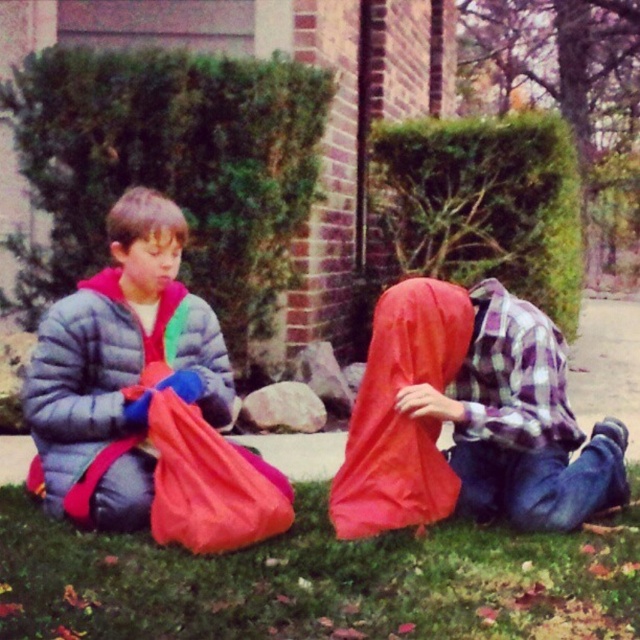
Question: Can you confirm if green grass at lower center is positioned to the right of matte blue puffer jacket at left?

Choices:
 (A) no
 (B) yes

Answer: (B)

Question: Does plaid fabric bag at center have a smaller size compared to matte red sleeping bag at center?

Choices:
 (A) no
 (B) yes

Answer: (A)

Question: Among these objects, which one is nearest to the camera?

Choices:
 (A) matte red plastic bag at lower left
 (B) plaid fabric bag at center
 (C) matte blue puffer jacket at left

Answer: (A)

Question: Which of these objects is positioned closest to the green grass at lower center?

Choices:
 (A) matte blue puffer jacket at left
 (B) plaid fabric bag at center

Answer: (B)

Question: Among these objects, which one is nearest to the camera?

Choices:
 (A) green grass at lower center
 (B) matte red sleeping bag at center
 (C) matte blue puffer jacket at left
 (D) plaid fabric bag at center

Answer: (A)

Question: Can you confirm if matte blue puffer jacket at left is bigger than matte red sleeping bag at center?

Choices:
 (A) yes
 (B) no

Answer: (A)